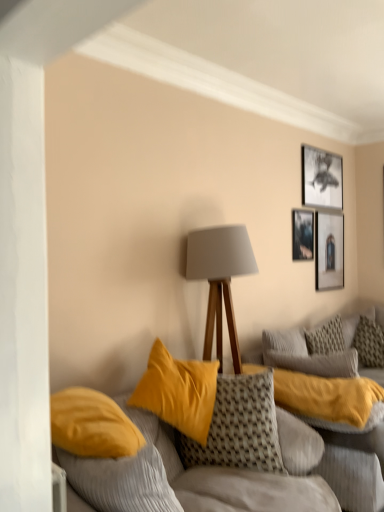
Question: Visually, is matte black picture frame at upper right, which is the first picture frame in bottom-to-top order, positioned to the left or to the right of textured woven pillow at center, acting as the 1th pillow starting from the front?

Choices:
 (A) right
 (B) left

Answer: (A)

Question: From a real-world perspective, is matte black picture frame at upper right, which is counted as the third picture frame, starting from the top, physically located above or below textured woven pillow at center, acting as the 2th pillow starting from the back?

Choices:
 (A) below
 (B) above

Answer: (B)

Question: Estimate the real-world distances between objects in this image. Which object is closer to the matte gray lampshade at center?

Choices:
 (A) matte black picture frame at upper right, which is the first picture frame in bottom-to-top order
 (B) velvet yellow cushions at center
 (C) textured gray pillow at right, marked as the 2th pillow in a front-to-back arrangement
 (D) black matte picture frame at upper right, which is counted as the 3th picture frame, starting from the bottom
 (E) textured woven pillow at center, acting as the 2th pillow starting from the right

Answer: (E)

Question: Based on their relative distances, which object is nearer to the matte gray lampshade at center?

Choices:
 (A) velvet yellow cushions at center
 (B) black matte picture frame at upper right, which is counted as the 3th picture frame, starting from the bottom
 (C) metallic silver picture frame at upper right, which is the second picture frame from top to bottom
 (D) textured gray pillow at right, marked as the 2th pillow in a front-to-back arrangement
 (E) matte black picture frame at upper right, which is the first picture frame in bottom-to-top order

Answer: (A)